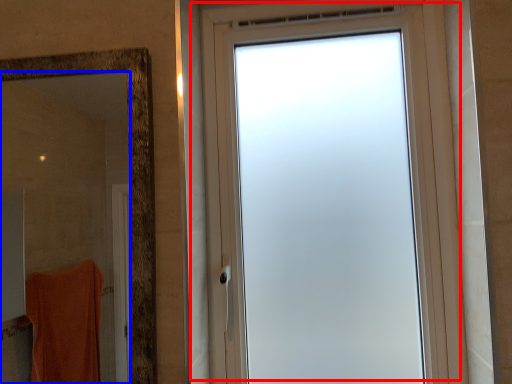
Question: Among these objects, which one is nearest to the camera, window (highlighted by a red box) or mirror (highlighted by a blue box)?

Choices:
 (A) window
 (B) mirror

Answer: (B)